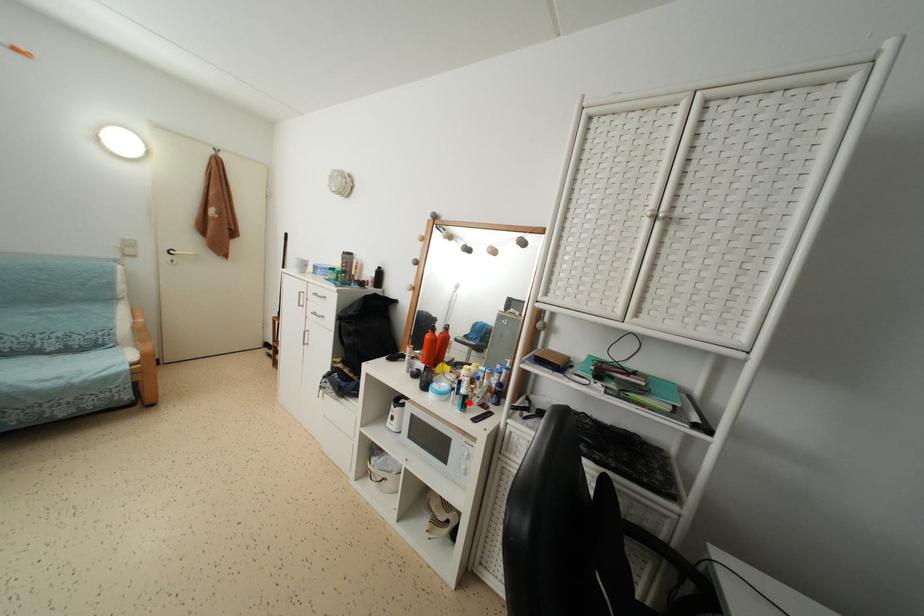
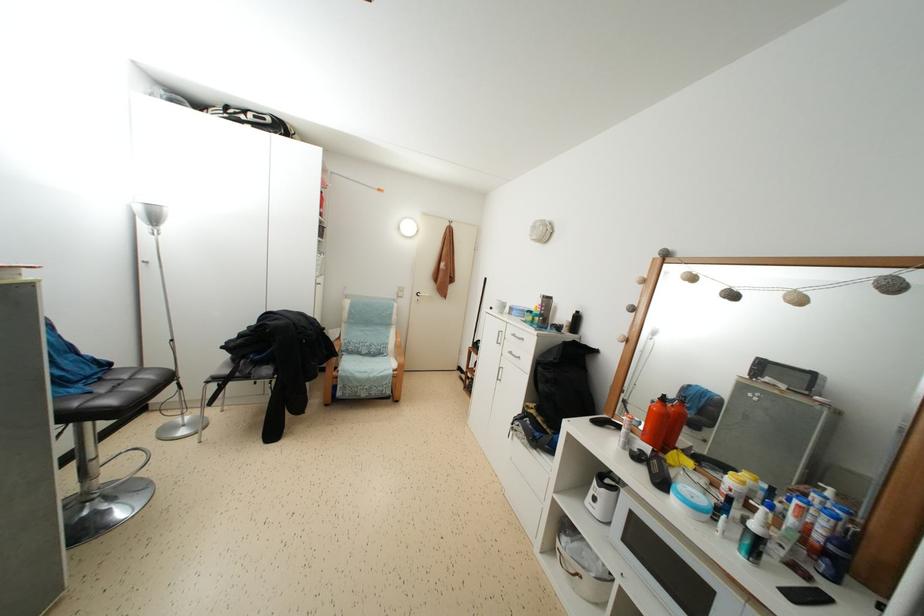
Question: I am providing you with two images of the same scene from different viewpoints. Given a red point in image1, look at the same physical point in image2. Is it:

Choices:
 (A) Closer to the viewpoint
 (B) Farther from the viewpoint

Answer: (A)